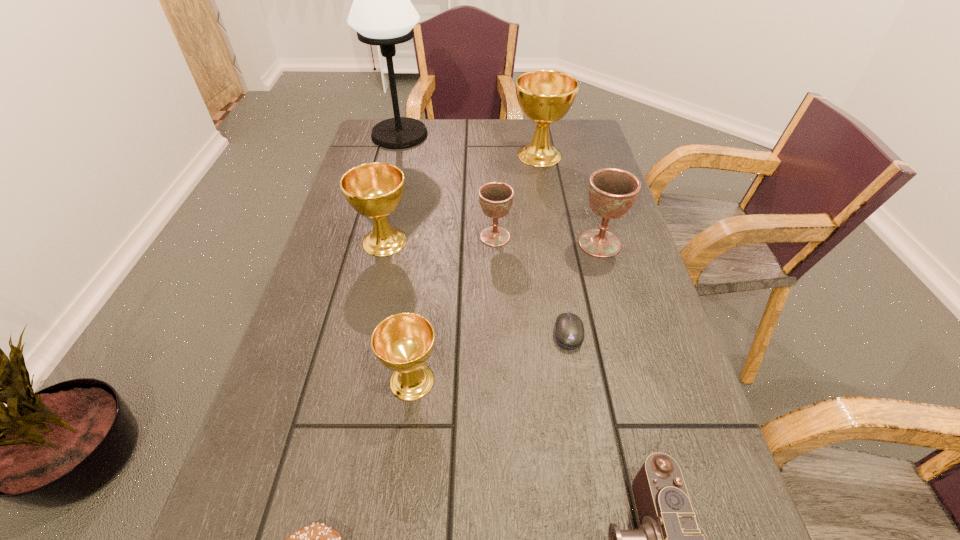
Identify the location of black computer mouse. The height and width of the screenshot is (540, 960). (569, 332).

What are the coordinates of `the shortest object` in the screenshot? It's located at (569, 332).

Locate an element on the screen. Image resolution: width=960 pixels, height=540 pixels. vacant region located 0.300m on the front of the table lamp is located at coordinates (381, 209).

At what (x,y) coordinates should I click in order to perform the action: click on free spot located 0.070m on the left of the eighth shortest object. Please return your answer as a coordinate pair (x, y). This screenshot has width=960, height=540. Looking at the image, I should click on (489, 155).

Identify the location of free region located 0.270m on the back of the second smallest gold chalice. Image resolution: width=960 pixels, height=540 pixels. (401, 166).

Locate an element on the screen. This screenshot has width=960, height=540. vacant area situated 0.350m on the front of the bigger brown chalice is located at coordinates (641, 393).

Find the location of a particular element. This screenshot has width=960, height=540. vacant space located on the right of the third chalice from left to right is located at coordinates (536, 237).

The image size is (960, 540). What are the coordinates of `free location located 0.330m on the back of the third nearest object` in the screenshot? It's located at (428, 243).

Locate an element on the screen. Image resolution: width=960 pixels, height=540 pixels. vacant area situated 0.190m on the left of the black computer mouse is located at coordinates (460, 333).

Where is `table lamp situated at the far edge`? The image size is (960, 540). table lamp situated at the far edge is located at coordinates (382, 14).